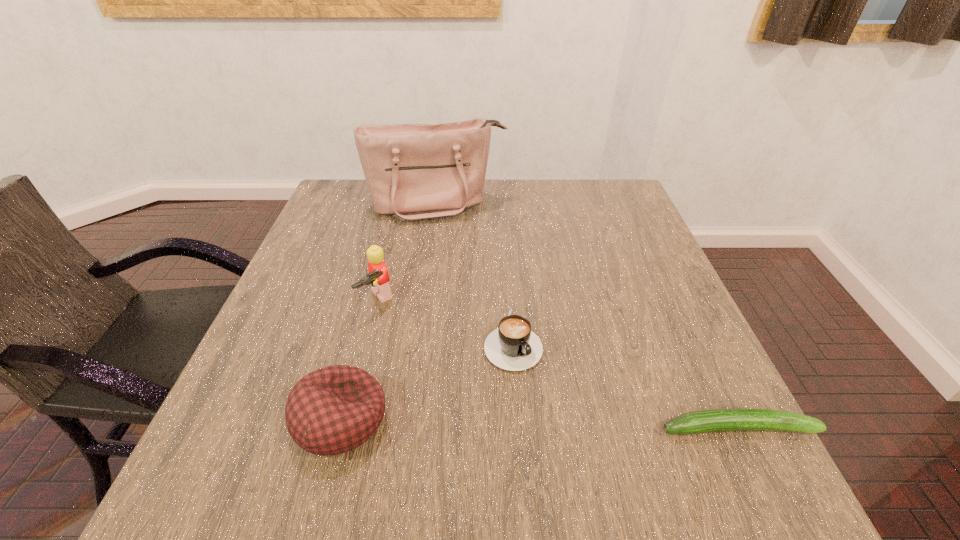
The width and height of the screenshot is (960, 540). In order to click on the third tallest object in this screenshot , I will do `click(335, 409)`.

At what (x,y) coordinates should I click in order to perform the action: click on zucchini. Please return your answer as a coordinate pair (x, y). Looking at the image, I should click on (703, 421).

Where is `the shortest object`? the shortest object is located at coordinates (703, 421).

Where is `cappuccino`? cappuccino is located at coordinates (513, 346).

Image resolution: width=960 pixels, height=540 pixels. Find the location of `shoulder bag`. shoulder bag is located at coordinates tap(414, 172).

Find the location of a particular element. The height and width of the screenshot is (540, 960). the tallest object is located at coordinates (414, 172).

The image size is (960, 540). In order to click on the second tallest object in this screenshot , I will do `click(378, 276)`.

This screenshot has height=540, width=960. In order to click on vacant space located 0.370m on the right of the beanbag in this screenshot , I will do `click(604, 420)`.

The image size is (960, 540). What are the coordinates of `free space located with the handle on the side of the cappuccino` in the screenshot? It's located at (545, 394).

Identify the location of free spot located 0.150m with the handle on the side of the cappuccino. (575, 435).